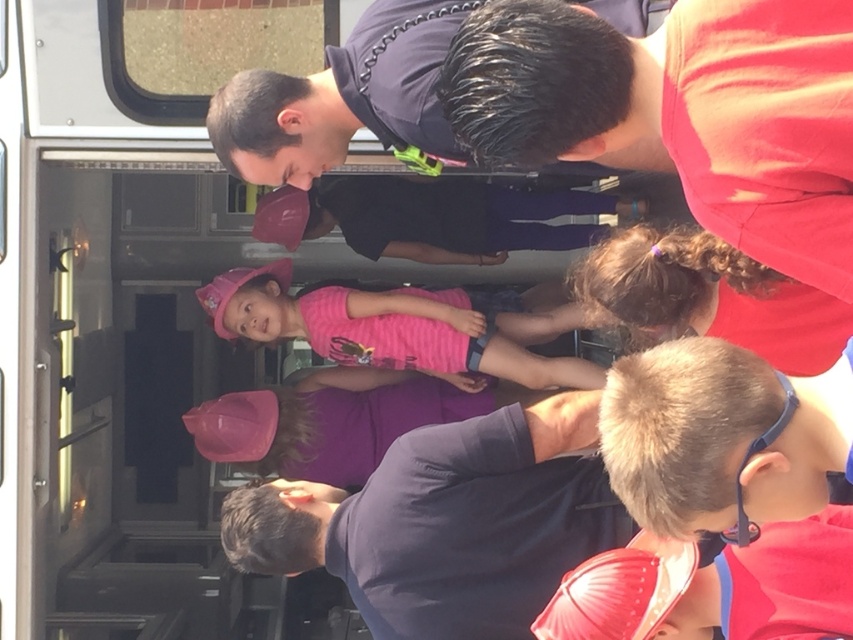
Question: Which point is closer to the camera?

Choices:
 (A) pink fabric at center
 (B) purple matte shirt at center
 (C) red matte shirt at upper right
 (D) pink fabric shirt at center

Answer: (C)

Question: Is pink fabric shirt at center bigger than purple matte shirt at center?

Choices:
 (A) no
 (B) yes

Answer: (B)

Question: Is dark blue uniform at center further to camera compared to purple matte shirt at center?

Choices:
 (A) yes
 (B) no

Answer: (B)

Question: Estimate the real-world distances between objects in this image. Which object is farther from the pink fabric at center?

Choices:
 (A) dark blue uniform at center
 (B) purple matte shirt at center

Answer: (A)

Question: In this image, where is red matte shirt at upper right located relative to dark blue uniform at center?

Choices:
 (A) right
 (B) left

Answer: (A)

Question: Estimate the real-world distances between objects in this image. Which object is closer to the red matte shirt at upper right?

Choices:
 (A) purple matte shirt at center
 (B) dark blue uniform at center
 (C) pink fabric at center

Answer: (B)